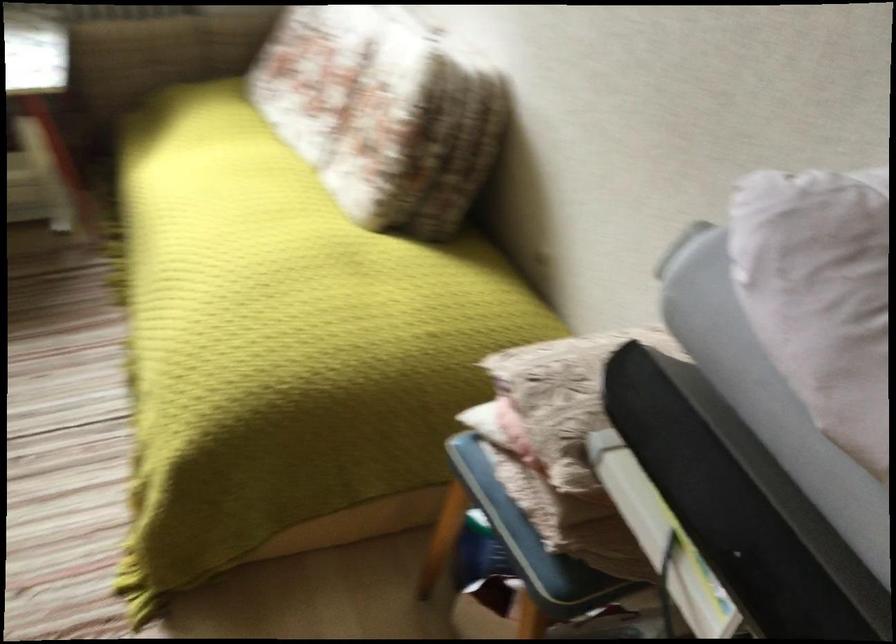
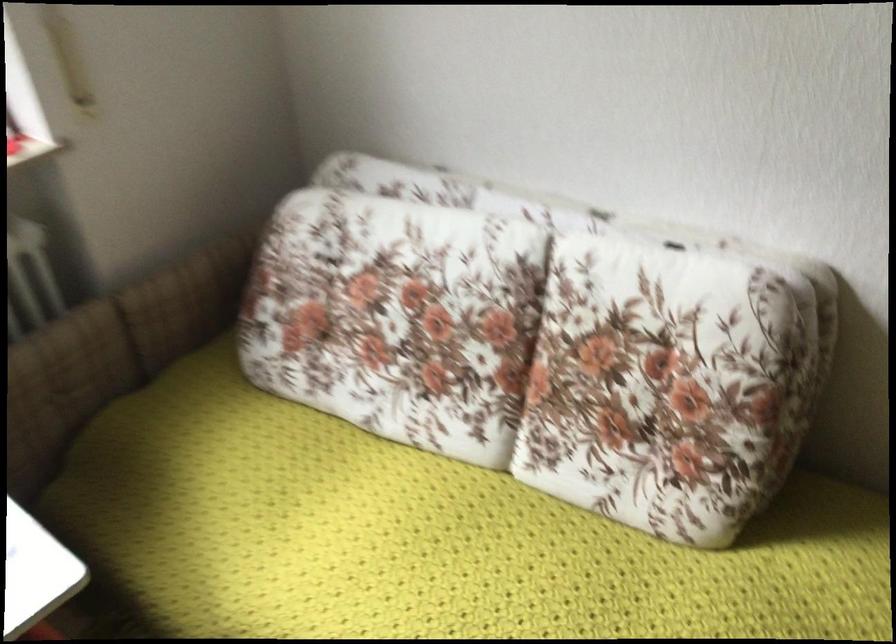
Where in the second image is the point corresponding to pixel 350 102 from the first image?

(530, 354)